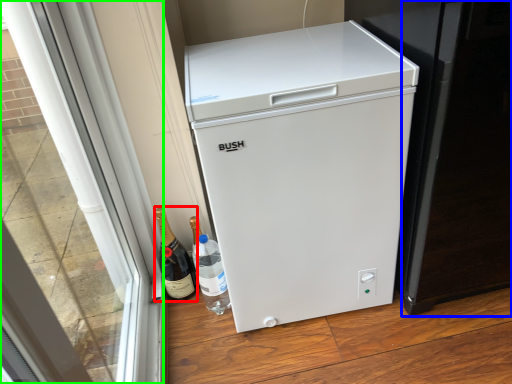
Question: Which object is positioned farthest from wine (highlighted by a red box)? Select from screen door (highlighted by a blue box) and glass door (highlighted by a green box).

Choices:
 (A) screen door
 (B) glass door

Answer: (A)